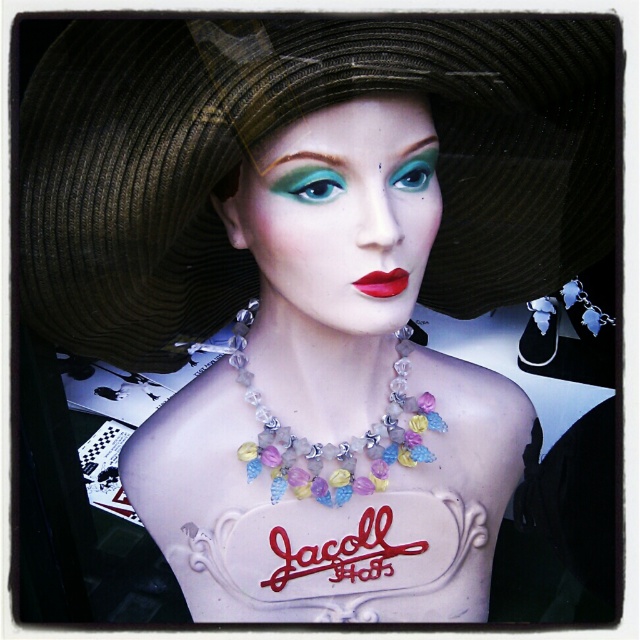
You are a stylist preparing to adjust the mannequin. You need to know which hat has a wider brim between the brown straw hat at upper center and the matte black hat at upper center. Which one should you choose?

The brown straw hat at upper center has a larger width than the matte black hat at upper center, so you should choose the brown straw hat at upper center for a wider brim.

You are a photographer standing 1 meter away from the mannequin. You want to take a closeup shot of the brown straw hat at upper center. Can you move closer to the mannequin to get a better shot without exceeding the minimum safe distance of 50 cm from the hat?

The brown straw hat at upper center is 80.91 centimeters away from camera. Since you are currently 1 meter away, moving closer to 50 cm from the hat would require getting within 50 cm, which is allowed as the minimum safe distance is exactly 50 cm. However, you need to ensure you don not go beyond that distance.

What object is located at the coordinate point (280, 128) on the mannequin?

The point (280, 128) indicates the brown straw hat at upper center.